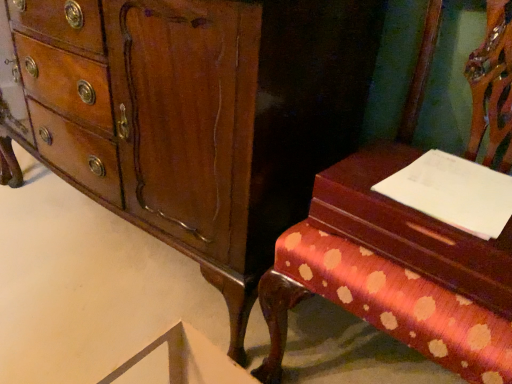
I want to click on blank area beneath mahogany wood chest of drawers at center (from a real-world perspective), so click(130, 248).